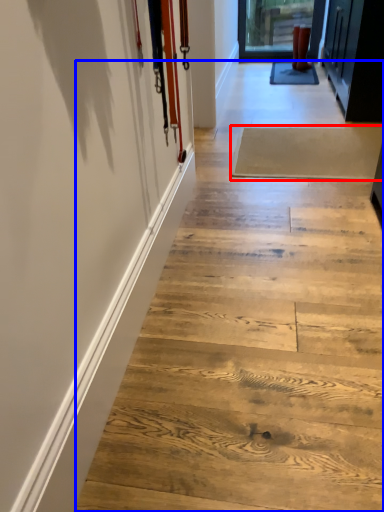
Question: Which point is closer to the camera, plank (highlighted by a red box) or stair (highlighted by a blue box)?

Choices:
 (A) plank
 (B) stair

Answer: (B)